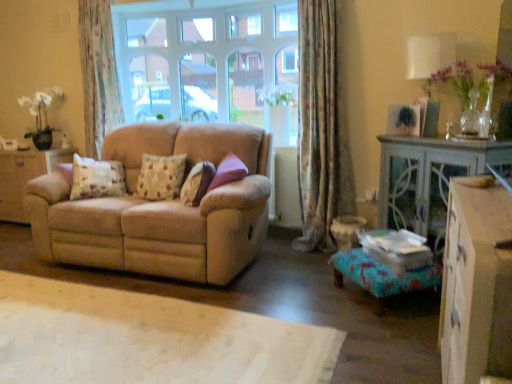
Question: From the image's perspective, is turquoise fabric footrest at lower right located above or below beige corduroy couch at center?

Choices:
 (A) below
 (B) above

Answer: (A)

Question: Relative to beige corduroy couch at center, is turquoise fabric footrest at lower right in front or behind?

Choices:
 (A) behind
 (B) front

Answer: (B)

Question: Estimate the real-world distances between objects in this image. Which object is farther from the turquoise fabric footrest at lower right?

Choices:
 (A) clear glass window at center
 (B) white fabric lampshade at upper right
 (C) fluffy floral pillow at center, the 2th pillow from the right
 (D) beige fabric sofa at left, the second dresser viewed from the right
 (E) fluffy beige pillow at center, the first pillow in the right-to-left sequence

Answer: (D)

Question: Considering the real-world distances, which object is farthest from the wooden cabinet at right?

Choices:
 (A) floral fabric curtain at upper left, the 1th curtain viewed from the back
 (B) beige corduroy couch at center
 (C) fluffy floral pillow at center, which is counted as the second pillow, starting from the left
 (D) fluffy beige pillow at center, the first pillow in the right-to-left sequence
 (E) beige fabric sofa at left, which appears as the 1th dresser when viewed from the back

Answer: (E)